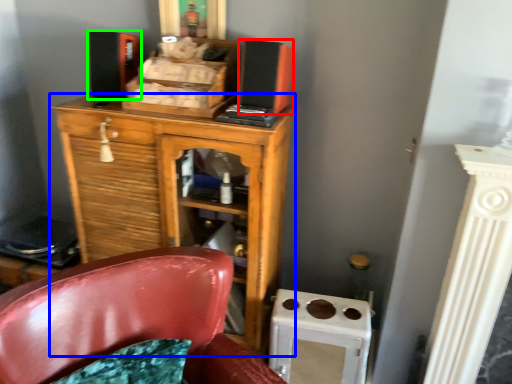
Question: Which object is the farthest from speaker (highlighted by a red box)? Choose among these: chest of drawers (highlighted by a blue box) or speaker (highlighted by a green box).

Choices:
 (A) chest of drawers
 (B) speaker

Answer: (B)